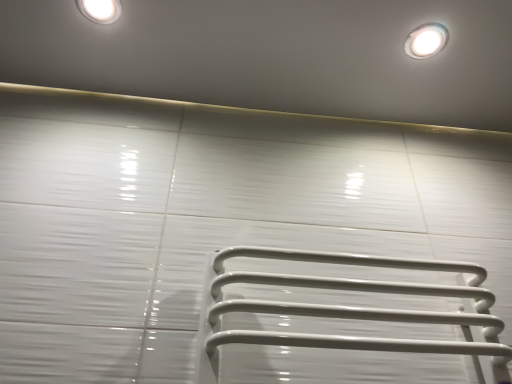
Question: Looking at their shapes, would you say white glossy droplight at upper right is wider or thinner than white glossy light fixture at upper left?

Choices:
 (A) wide
 (B) thin

Answer: (A)

Question: From the image's perspective, is white glossy droplight at upper right positioned above or below white glossy light fixture at upper left?

Choices:
 (A) above
 (B) below

Answer: (B)

Question: Is white glossy droplight at upper right in front of or behind white glossy light fixture at upper left in the image?

Choices:
 (A) front
 (B) behind

Answer: (B)

Question: In terms of height, does white glossy light fixture at upper left look taller or shorter compared to white glossy droplight at upper right?

Choices:
 (A) short
 (B) tall

Answer: (A)

Question: Does point (92, 11) appear closer or farther from the camera than point (436, 44)?

Choices:
 (A) farther
 (B) closer

Answer: (B)

Question: From the image's perspective, is white glossy light fixture at upper left located above or below white glossy droplight at upper right?

Choices:
 (A) below
 (B) above

Answer: (B)

Question: Looking at their shapes, would you say white glossy light fixture at upper left is wider or thinner than white glossy droplight at upper right?

Choices:
 (A) wide
 (B) thin

Answer: (B)